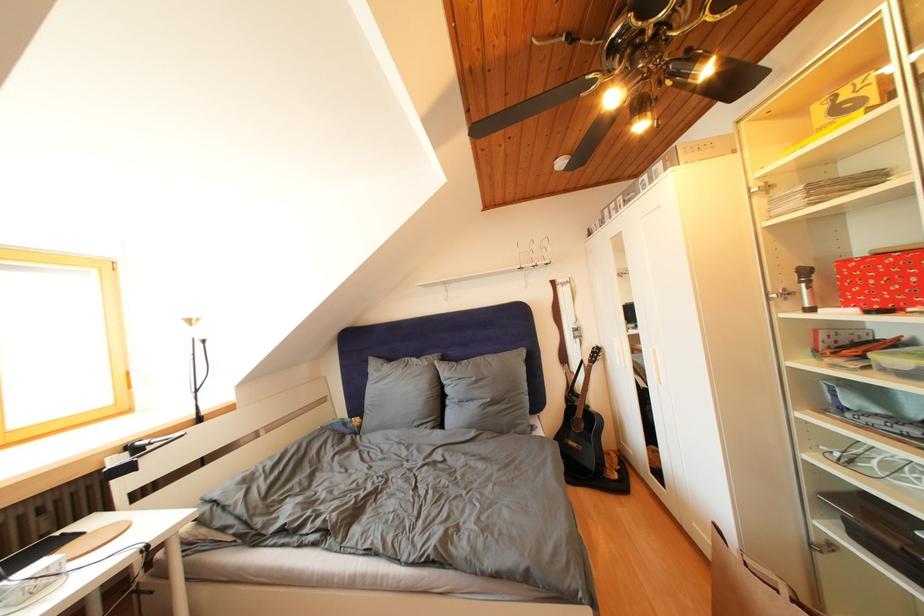
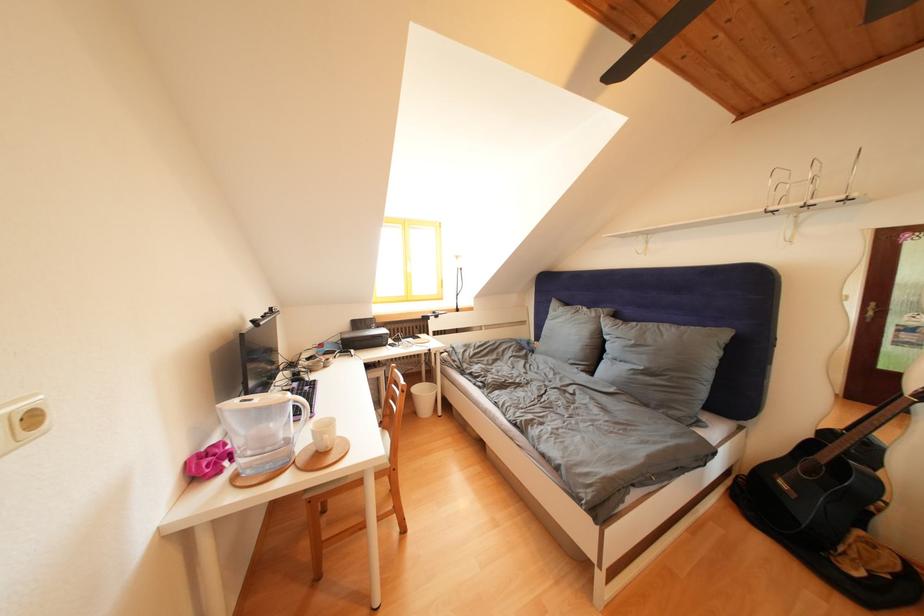
Locate, in the second image, the point that corresponds to point (397, 365) in the first image.

(575, 310)